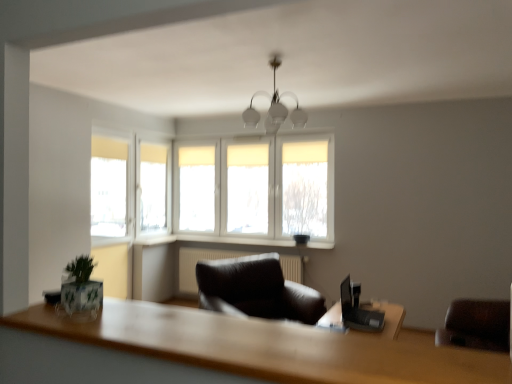
Question: Does white fabric window at center appear on the left side of green matte plant at lower left?

Choices:
 (A) no
 (B) yes

Answer: (A)

Question: From a real-world perspective, is white fabric window at center over green matte plant at lower left?

Choices:
 (A) no
 (B) yes

Answer: (B)

Question: Can you confirm if white fabric window at center is bigger than green matte plant at lower left?

Choices:
 (A) yes
 (B) no

Answer: (A)

Question: Considering the relative sizes of white fabric window at center and green matte plant at lower left in the image provided, is white fabric window at center wider than green matte plant at lower left?

Choices:
 (A) no
 (B) yes

Answer: (A)

Question: Is white fabric window at center taller than green matte plant at lower left?

Choices:
 (A) no
 (B) yes

Answer: (B)

Question: Considering the positions of point coord(275,241) and point coord(378,329), is point coord(275,241) closer or farther from the camera than point coord(378,329)?

Choices:
 (A) farther
 (B) closer

Answer: (A)

Question: From the image's perspective, relative to black plastic laptop at right, is white plastic window sill at center, the first window sill when ordered from right to left, above or below?

Choices:
 (A) above
 (B) below

Answer: (A)

Question: In the image, is white plastic window sill at center, placed as the second window sill when sorted from left to right, on the left side or the right side of black plastic laptop at right?

Choices:
 (A) right
 (B) left

Answer: (B)

Question: From a real-world perspective, is white plastic window sill at center, the first window sill when ordered from right to left, physically located above or below black plastic laptop at right?

Choices:
 (A) below
 (B) above

Answer: (B)

Question: Based on their positions, is white plastic window sill at center, placed as the second window sill when sorted from left to right, located to the left or right of white frosted glass chandelier at center?

Choices:
 (A) left
 (B) right

Answer: (A)

Question: Relative to white frosted glass chandelier at center, is white plastic window sill at center, the first window sill when ordered from right to left, in front or behind?

Choices:
 (A) behind
 (B) front

Answer: (A)

Question: From their relative heights in the image, would you say white plastic window sill at center, placed as the second window sill when sorted from left to right, is taller or shorter than white frosted glass chandelier at center?

Choices:
 (A) short
 (B) tall

Answer: (A)

Question: From the image's perspective, is white plastic window sill at center, the first window sill when ordered from right to left, located above or below white frosted glass chandelier at center?

Choices:
 (A) below
 (B) above

Answer: (A)

Question: From a real-world perspective, relative to white plastic window sill at center, placed as the second window sill when sorted from left to right, is green matte plant at lower left vertically above or below?

Choices:
 (A) below
 (B) above

Answer: (B)

Question: Is green matte plant at lower left bigger or smaller than white plastic window sill at center, the first window sill when ordered from right to left?

Choices:
 (A) big
 (B) small

Answer: (B)